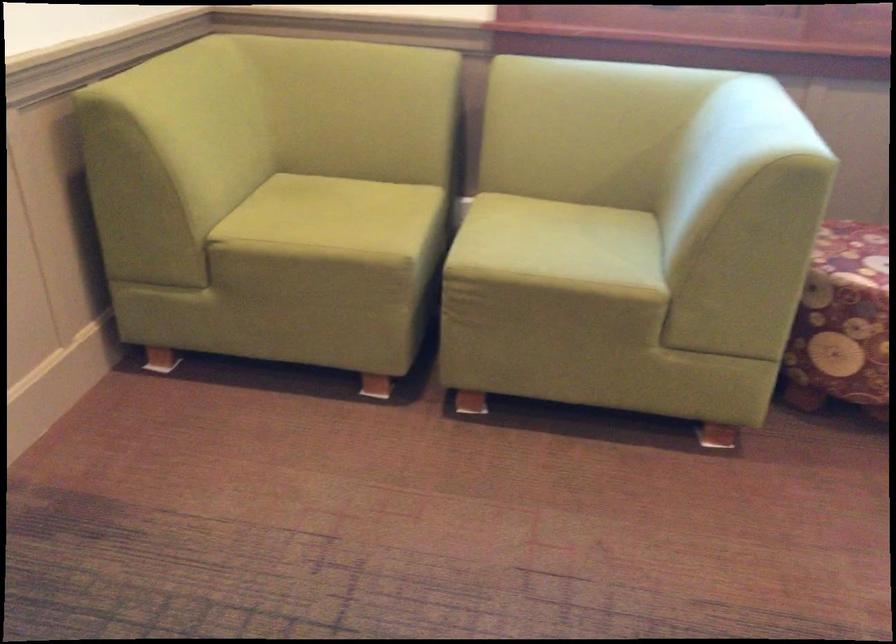
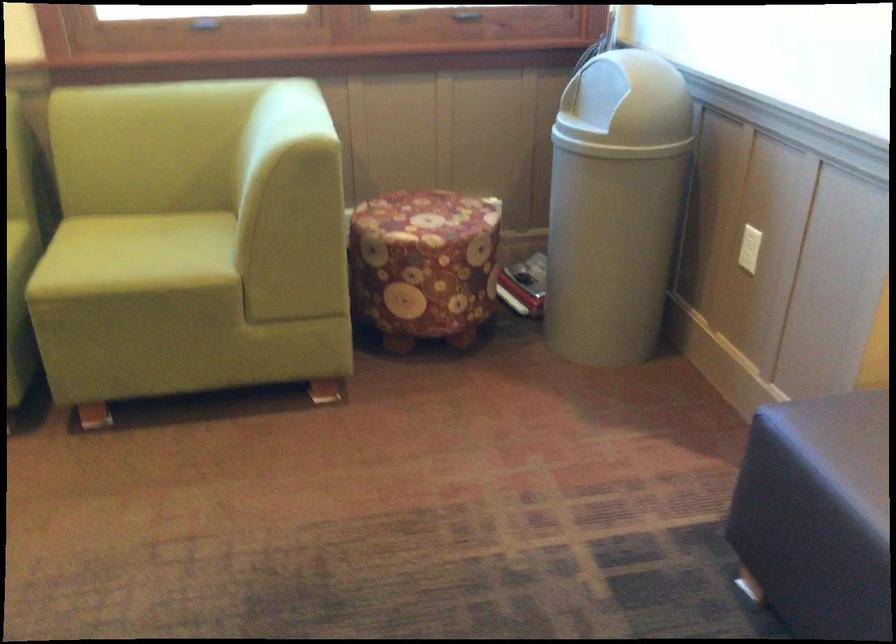
In the second image, find the point that corresponds to (563,238) in the first image.

(142, 252)